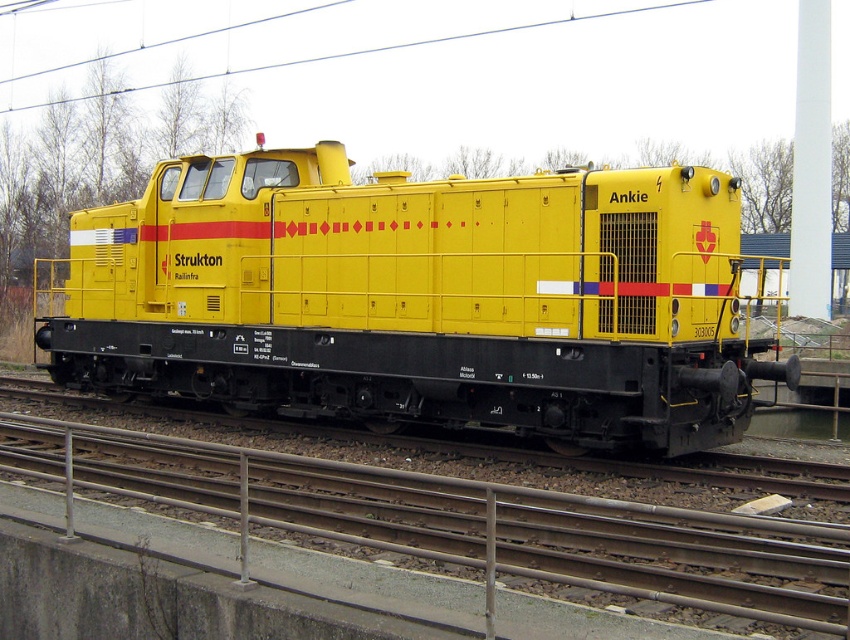
Between yellow matte train at center and metal at center, which one appears on the left side from the viewer's perspective?

From the viewer's perspective, metal at center appears more on the left side.

Between yellow matte train at center and metal at center, which one is positioned higher?

Positioned higher is yellow matte train at center.

Does point (729, 195) come closer to viewer compared to point (727, 604)?

No, it is not.

The image size is (850, 640). In order to click on yellow matte train at center in this screenshot , I will do `click(421, 298)`.

Who is taller, metal at center or metallic wire at upper center?

metallic wire at upper center

From the picture: Is metal at center smaller than metallic wire at upper center?

Indeed, metal at center has a smaller size compared to metallic wire at upper center.

This screenshot has width=850, height=640. What do you see at coordinates (465, 520) in the screenshot? I see `metal at center` at bounding box center [465, 520].

Find the location of `metal at center`. metal at center is located at coordinates (465, 520).

Can you confirm if yellow matte train at center is bigger than metallic wire at upper center?

Actually, yellow matte train at center might be smaller than metallic wire at upper center.

Between yellow matte train at center and metallic wire at upper center, which one has less height?

With less height is yellow matte train at center.

Where is `yellow matte train at center`? The height and width of the screenshot is (640, 850). yellow matte train at center is located at coordinates (421, 298).